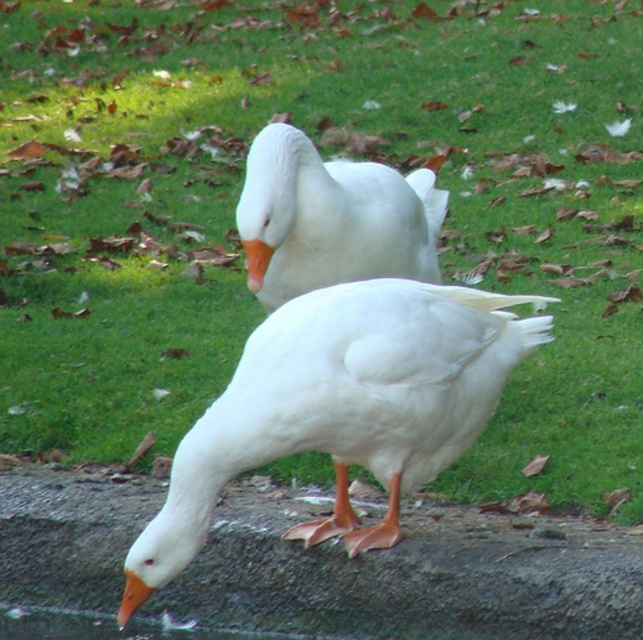
You are a photographer trying to capture both the white matte goose at center and the orange matte beak at lower left in a single frame. Based on their sizes, which object would you need to focus on more carefully to ensure it fits entirely within the camera view?

The white matte goose at center is wider than the orange matte beak at lower left, so you should focus on ensuring the white matte goose at center fits entirely within the camera view first, as it requires more space.

You are a drone operator trying to map a park. You see a point labeled as point [412,577] in the image. Based on the scene, what material is at that location?

The point [412,577] corresponds to concrete at lower left.